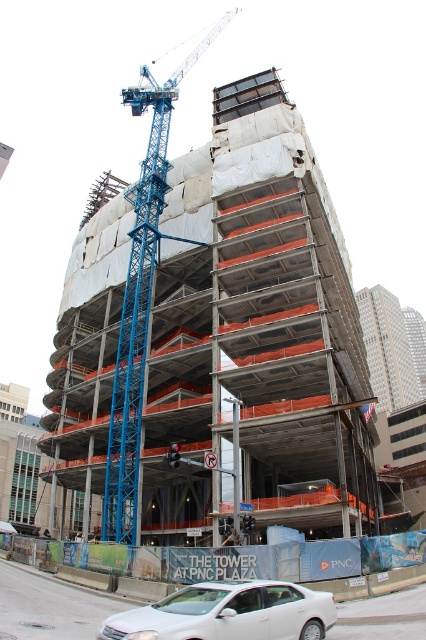
Does blue metallic crane at center-left lie in front of white concrete construction site at lower center?

No.

The height and width of the screenshot is (640, 426). What do you see at coordinates (140, 298) in the screenshot?
I see `blue metallic crane at center-left` at bounding box center [140, 298].

The image size is (426, 640). In order to click on blue metallic crane at center-left in this screenshot , I will do `click(140, 298)`.

From the picture: Can you confirm if white concrete construction site at lower center is thinner than white matte sedan at lower center?

No, white concrete construction site at lower center is not thinner than white matte sedan at lower center.

Is white concrete construction site at lower center smaller than white matte sedan at lower center?

No.

This screenshot has height=640, width=426. Identify the location of white concrete construction site at lower center. (49, 608).

Is blue metallic crane at center-left bigger than white matte sedan at lower center?

Indeed, blue metallic crane at center-left has a larger size compared to white matte sedan at lower center.

Which is behind, point (150, 262) or point (216, 598)?

The point (150, 262) is more distant.

At what (x,y) coordinates should I click in order to perform the action: click on blue metallic crane at center-left. Please return your answer as a coordinate pair (x, y). Looking at the image, I should click on (140, 298).